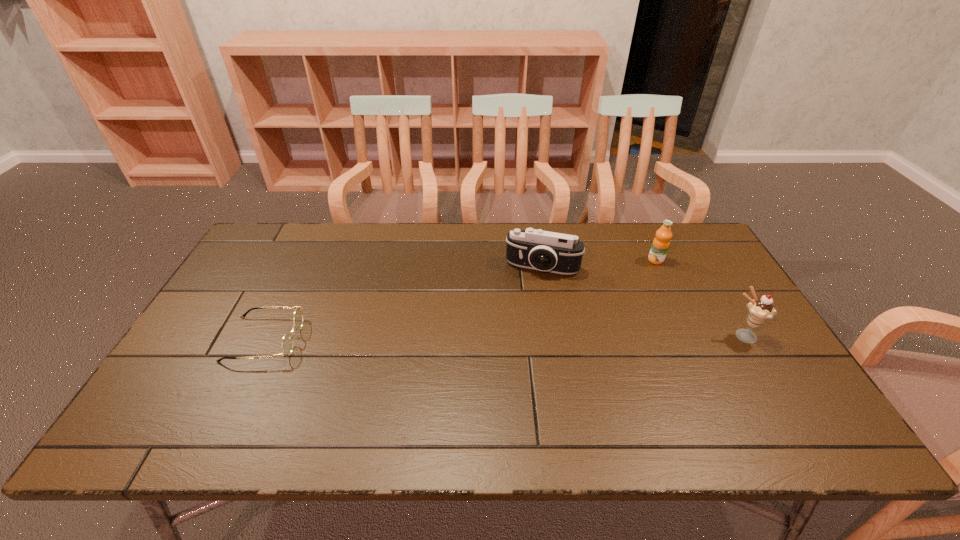
Where is `the shortest object`? The image size is (960, 540). the shortest object is located at coordinates (287, 342).

Where is `the leftmost object`? The image size is (960, 540). the leftmost object is located at coordinates (287, 342).

Where is `the rightmost object`? The height and width of the screenshot is (540, 960). the rightmost object is located at coordinates (760, 310).

Image resolution: width=960 pixels, height=540 pixels. What are the coordinates of `the second object from left to right` in the screenshot? It's located at (559, 253).

At what (x,y) coordinates should I click in order to perform the action: click on orange juice. Please return your answer as a coordinate pair (x, y). Image resolution: width=960 pixels, height=540 pixels. Looking at the image, I should click on (660, 245).

Locate an element on the screen. free spot located on the lenses of the spectacles is located at coordinates (374, 339).

You are a GUI agent. You are given a task and a screenshot of the screen. Output one action in this format:
    pyautogui.click(x=<x>, y=<y>)
    Task: Click on the free region located on the left of the icecream
    
    Given the screenshot: What is the action you would take?
    pyautogui.click(x=696, y=336)

Identify the location of vacant space located 0.320m on the front lens of the second object from left to right. (512, 359).

You are a GUI agent. You are given a task and a screenshot of the screen. Output one action in this format:
    pyautogui.click(x=<x>, y=<y>)
    Task: Click on the free space located on the front lens of the second object from left to right
    
    Given the screenshot: What is the action you would take?
    pyautogui.click(x=530, y=294)

You are a GUI agent. You are given a task and a screenshot of the screen. Output one action in this format:
    pyautogui.click(x=<x>, y=<y>)
    Task: Click on the free space located 0.240m on the front lens of the second object from left to right
    This screenshot has height=540, width=960.
    Given the screenshot: What is the action you would take?
    pyautogui.click(x=518, y=336)